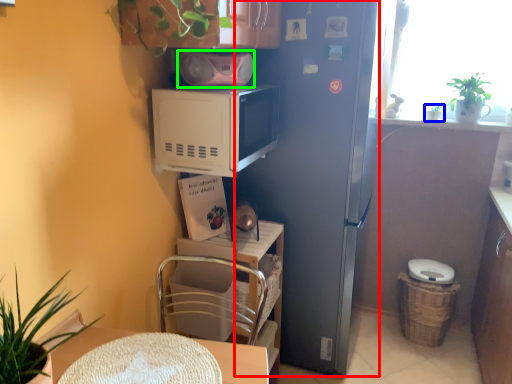
Question: Estimate the real-world distances between objects in this image. Which object is closer to fridge (highlighted by a red box), houseplant (highlighted by a blue box) or appliance (highlighted by a green box)?

Choices:
 (A) houseplant
 (B) appliance

Answer: (B)